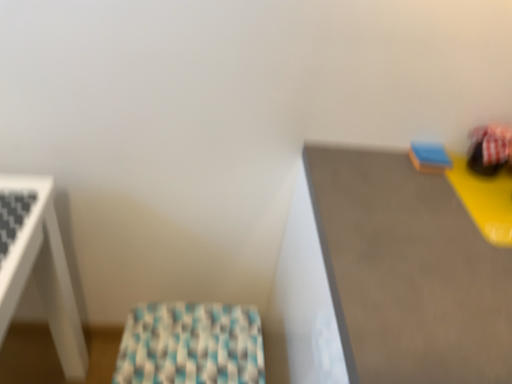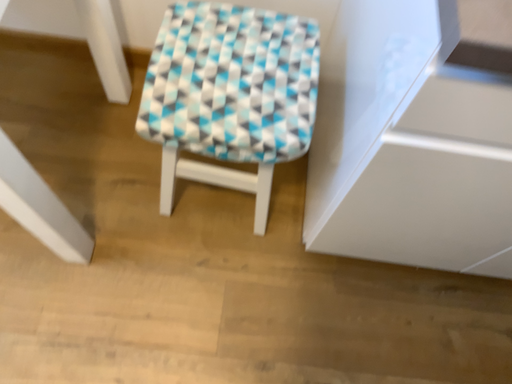
Question: Which way did the camera rotate in the video?

Choices:
 (A) rotated upward
 (B) rotated downward

Answer: (B)